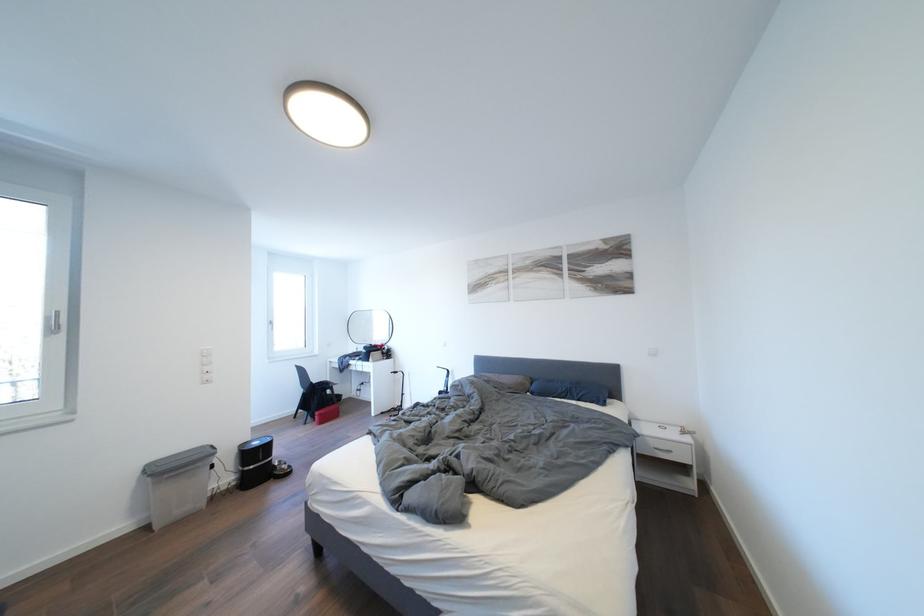
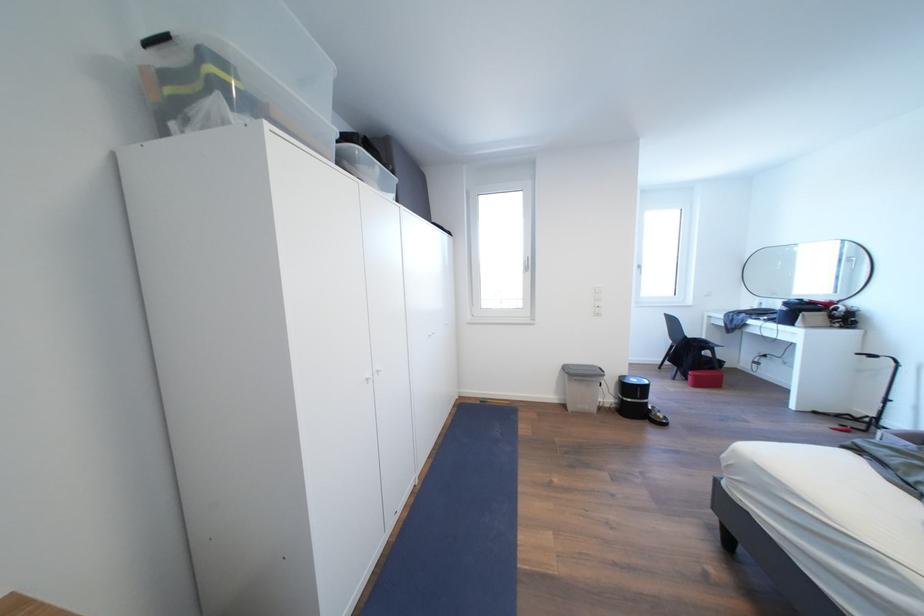
Question: The camera is either moving clockwise (left) or counter-clockwise (right) around the object. The first image is from the beginning of the video and the second image is from the end. Is the camera moving left or right when shooting the video?

Choices:
 (A) Left
 (B) Right

Answer: (B)